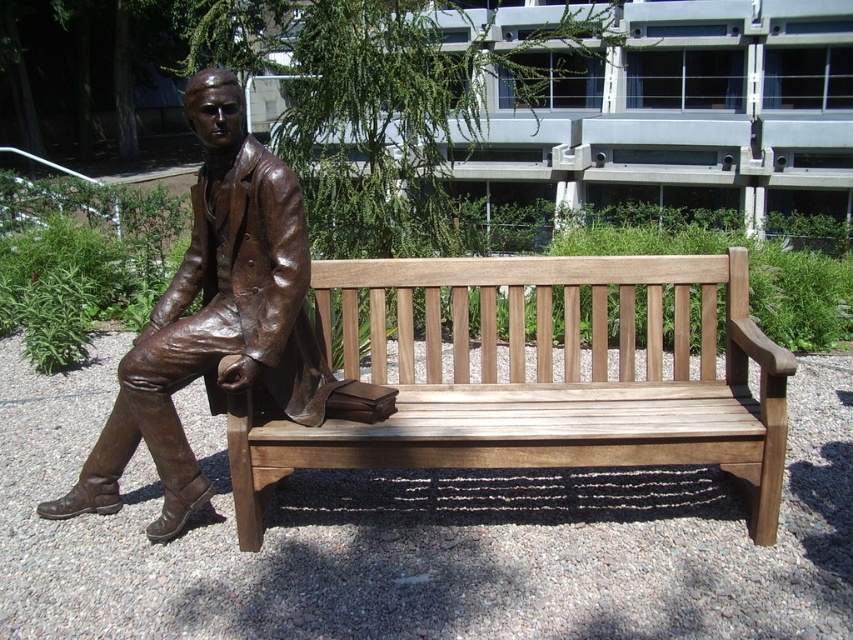
You are a person with a 60 cm wide backpack. You want to walk through the space between the light brown wood bench at center and the bronze statue at center. Can you pass through without removing your backpack?

The distance between the light brown wood bench at center and the bronze statue at center is 69.06 centimeters. Since your backpack is 60 cm wide, you can pass through the space as the distance is wider than your backpack.

You are standing at the point marked as point (537, 380) in the image. What object are you currently standing on?

The point (537, 380) corresponds to the light brown wood bench at center.

You are standing at the entrance of the park and want to sit on the light brown wood bench at center. Which direction should you walk to reach it?

You should walk towards the center of the park to reach the light brown wood bench at center located at point coordinates (537,380).